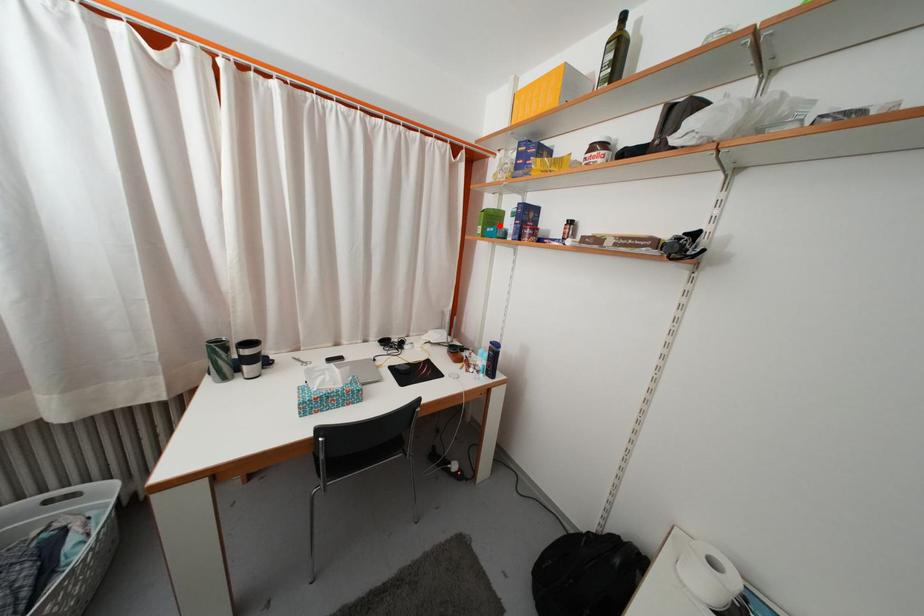
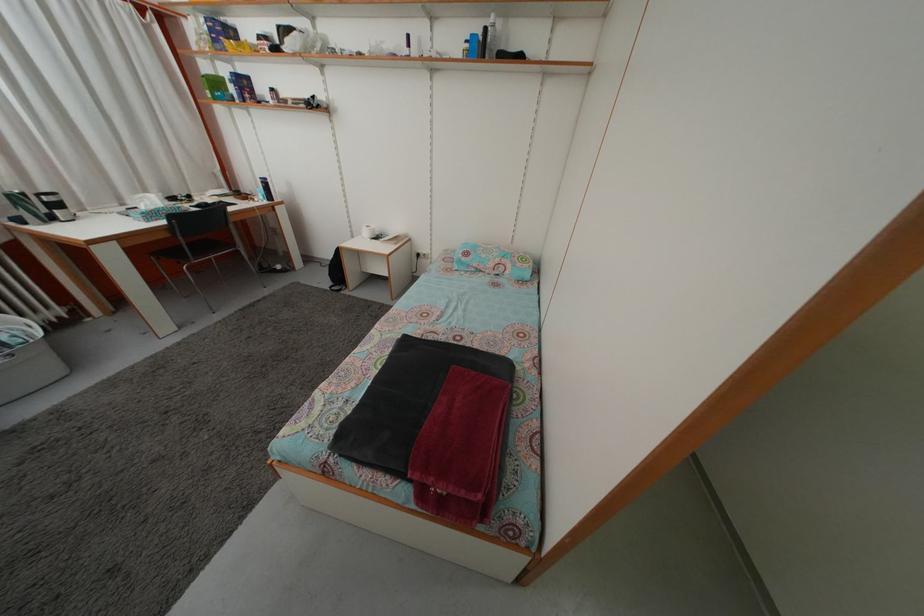
The point at the highlighted location is marked in the first image. Where is the corresponding point in the second image?

(223, 91)